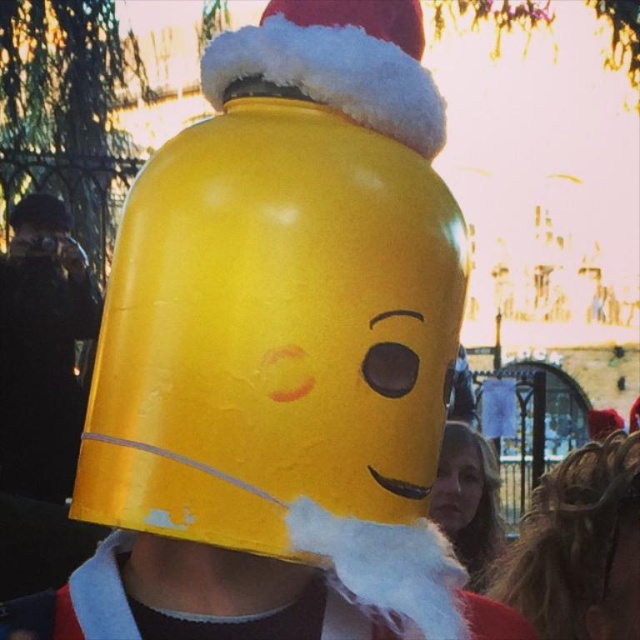
Between matte yellow helmet at center and smooth skin face at lower right, which one appears on the left side from the viewer's perspective?

matte yellow helmet at center

Between matte yellow helmet at center and smooth skin face at lower right, which one has more height?

With more height is matte yellow helmet at center.

You are a GUI agent. You are given a task and a screenshot of the screen. Output one action in this format:
    pyautogui.click(x=<x>, y=<y>)
    Task: Click on the matte yellow helmet at center
    The image size is (640, 640).
    Given the screenshot: What is the action you would take?
    pyautogui.click(x=282, y=291)

Locate an element on the screen. This screenshot has width=640, height=640. matte yellow helmet at center is located at coordinates (282, 291).